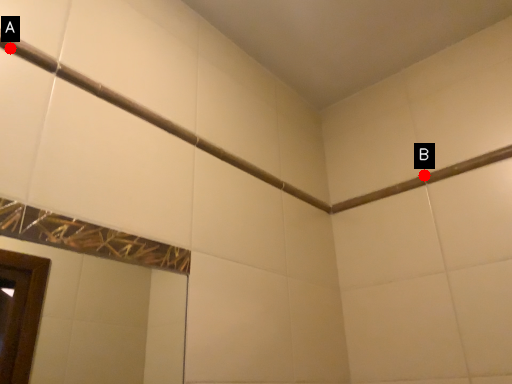
Question: Two points are circled on the image, labeled by A and B beside each circle. Which point is farther from the camera taking this photo?

Choices:
 (A) A is further
 (B) B is further

Answer: (B)